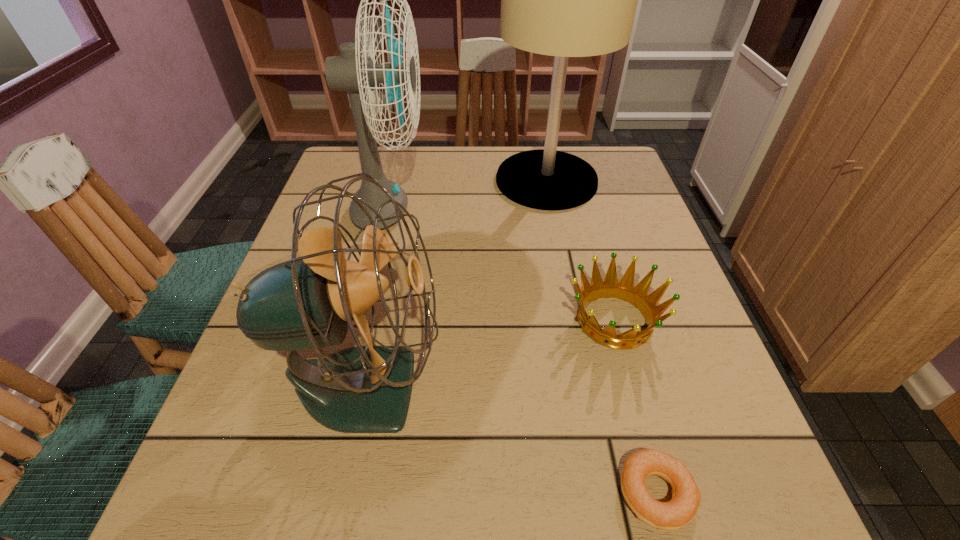
Locate an element on the screen. The width and height of the screenshot is (960, 540). vacant area that lies between the taller fan and the second shortest object is located at coordinates (502, 266).

The image size is (960, 540). In order to click on vacant space in between the second shortest object and the bagel in this screenshot , I will do `click(636, 407)`.

This screenshot has height=540, width=960. I want to click on free space between the table lamp and the fourth tallest object, so click(x=581, y=250).

You are a GUI agent. You are given a task and a screenshot of the screen. Output one action in this format:
    pyautogui.click(x=<x>, y=<y>)
    Task: Click on the empty space that is in between the shortest object and the crown
    The width and height of the screenshot is (960, 540).
    Given the screenshot: What is the action you would take?
    pyautogui.click(x=636, y=407)

This screenshot has width=960, height=540. Identify the location of free point between the taller fan and the bagel. (522, 353).

Where is `free space that is in between the second shortest object and the third shortest object`? free space that is in between the second shortest object and the third shortest object is located at coordinates (490, 353).

The height and width of the screenshot is (540, 960). In order to click on object that ranks as the third closest to the farther fan in this screenshot , I will do `click(638, 296)`.

Select which object appears as the second closest to the nearer fan. Please provide its 2D coordinates. Your answer should be formatted as a tuple, i.e. [(x, y)], where the tuple contains the x and y coordinates of a point satisfying the conditions above.

[(638, 296)]

Locate an element on the screen. This screenshot has height=540, width=960. vacant area that satisfies the following two spatial constraints: 1. on the back side of the bagel; 2. on the right side of the crown is located at coordinates (610, 320).

Locate an element on the screen. The width and height of the screenshot is (960, 540). free spot that satisfies the following two spatial constraints: 1. on the front-facing side of the taller fan; 2. on the back side of the bagel is located at coordinates (322, 493).